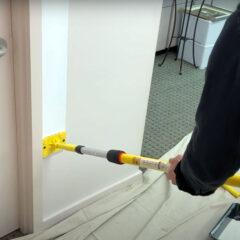
This screenshot has width=240, height=240. I want to click on wall, so click(119, 63).